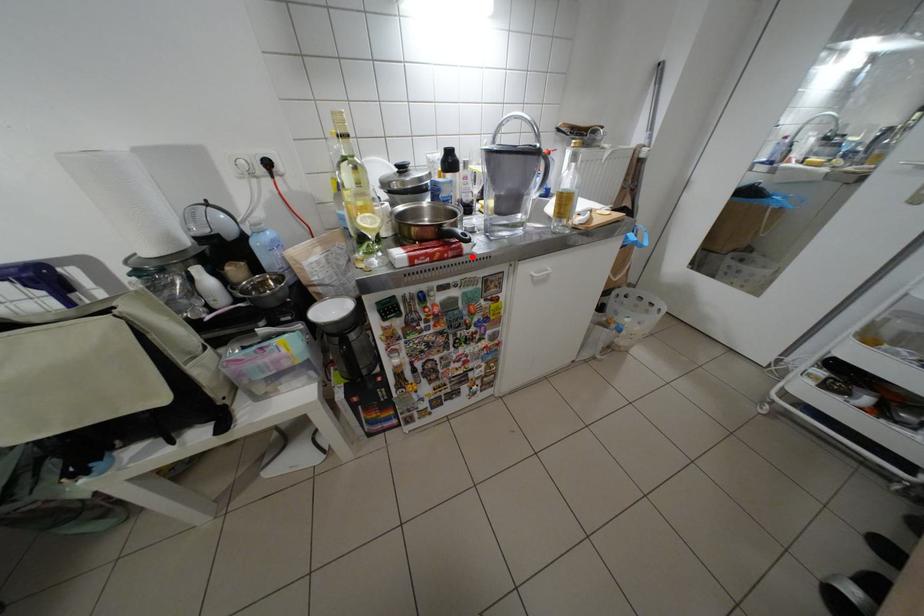
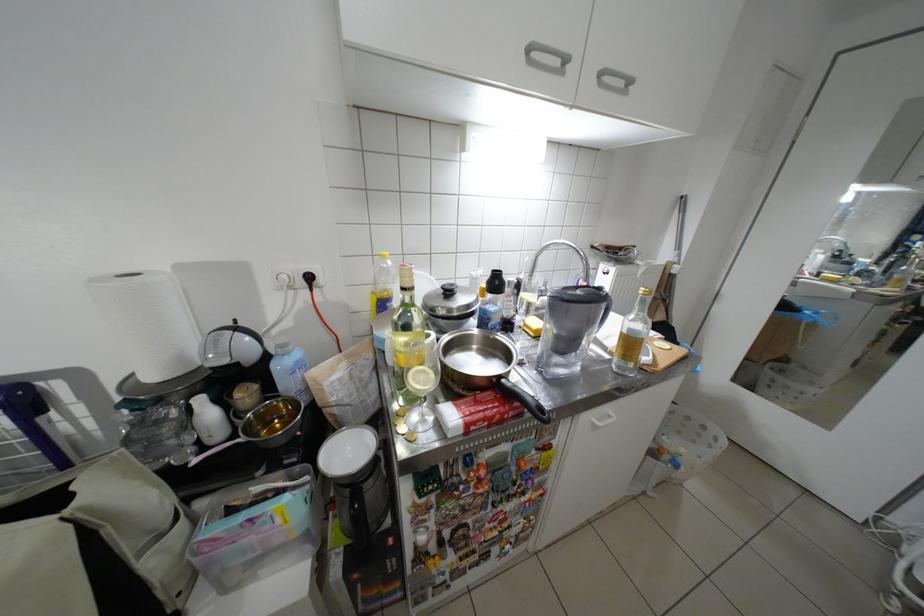
Question: A red point is marked in image1. In image2, is the corresponding 3D point closer to the camera or farther? Reply with the corresponding letter.

Choices:
 (A) The corresponding 3D point is closer.
 (B) The corresponding 3D point is farther.

Answer: (B)